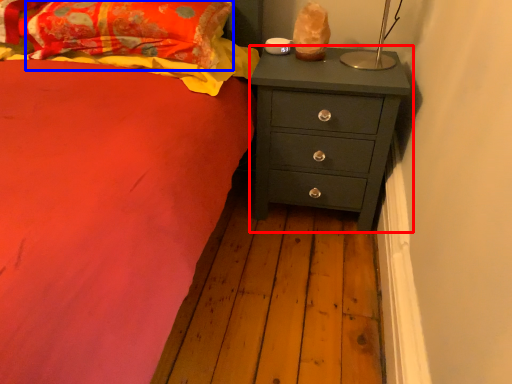
Question: Among these objects, which one is nearest to the camera, chest of drawers (highlighted by a red box) or pillow (highlighted by a blue box)?

Choices:
 (A) chest of drawers
 (B) pillow

Answer: (B)